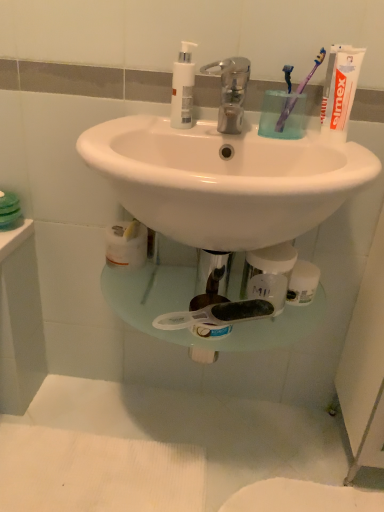
Image resolution: width=384 pixels, height=512 pixels. I want to click on vacant area to the right of white plastic pump bottle at upper center, so click(231, 130).